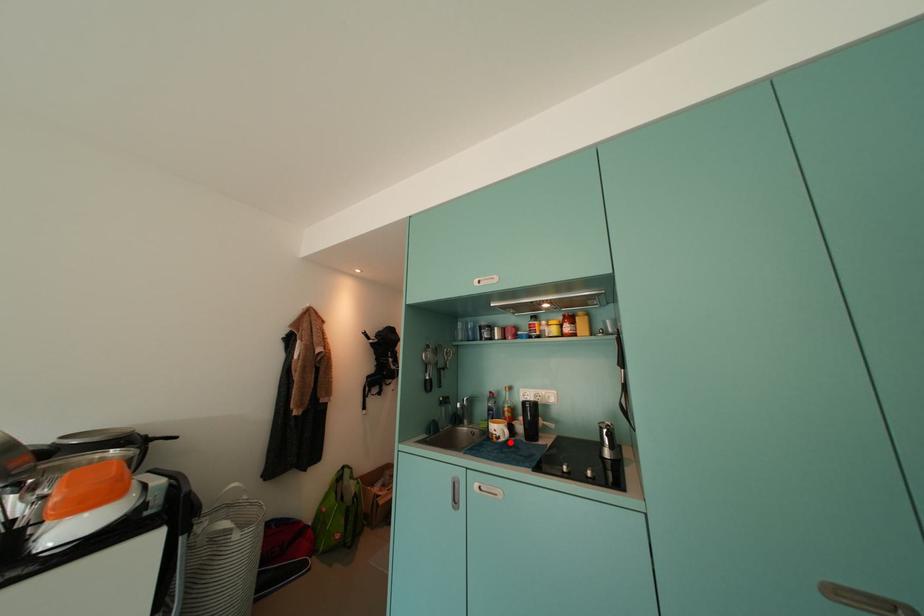
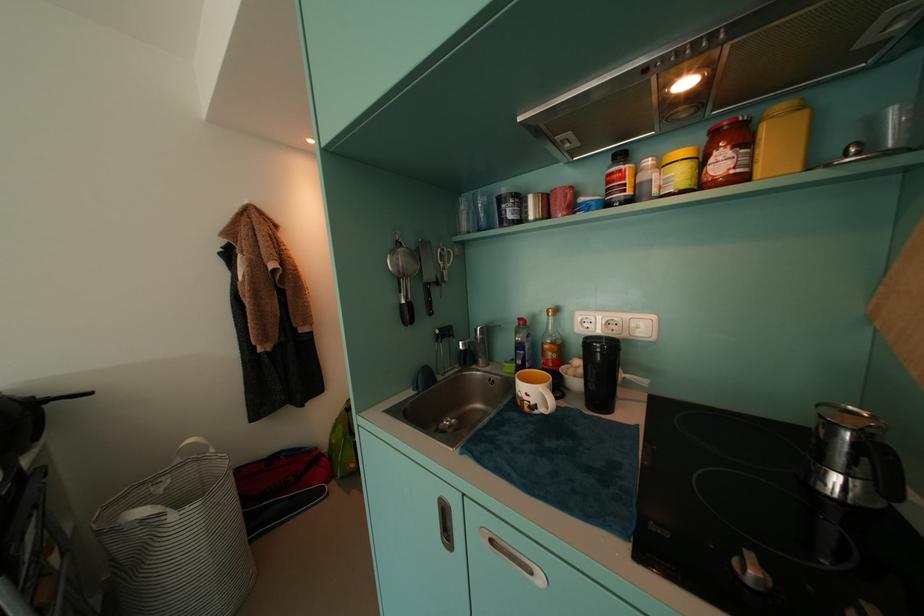
Locate, in the second image, the point that corresponds to the highlighted location in the first image.

(550, 413)